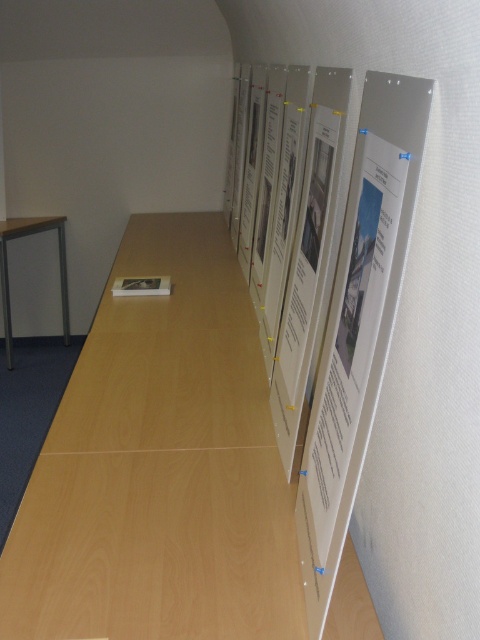
Does white paper at upper right appear on the right side of matte black table at left?

Yes, white paper at upper right is to the right of matte black table at left.

Can you confirm if white paper at upper right is positioned below matte black table at left?

Correct, white paper at upper right is located below matte black table at left.

Is point (408, 81) positioned in front of point (55, 225)?

Yes, it is in front of point (55, 225).

Identify the location of white paper at upper right. (359, 323).